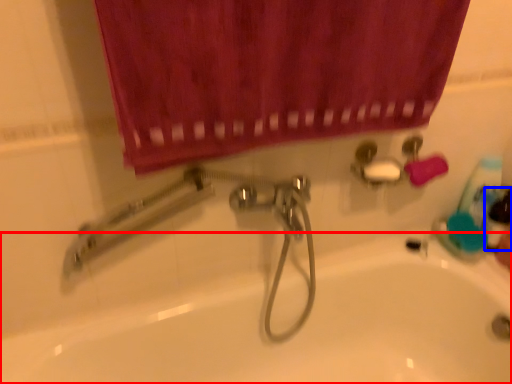
Question: Among these objects, which one is nearest to the camera, bath (highlighted by a red box) or mouthwash (highlighted by a blue box)?

Choices:
 (A) bath
 (B) mouthwash

Answer: (A)